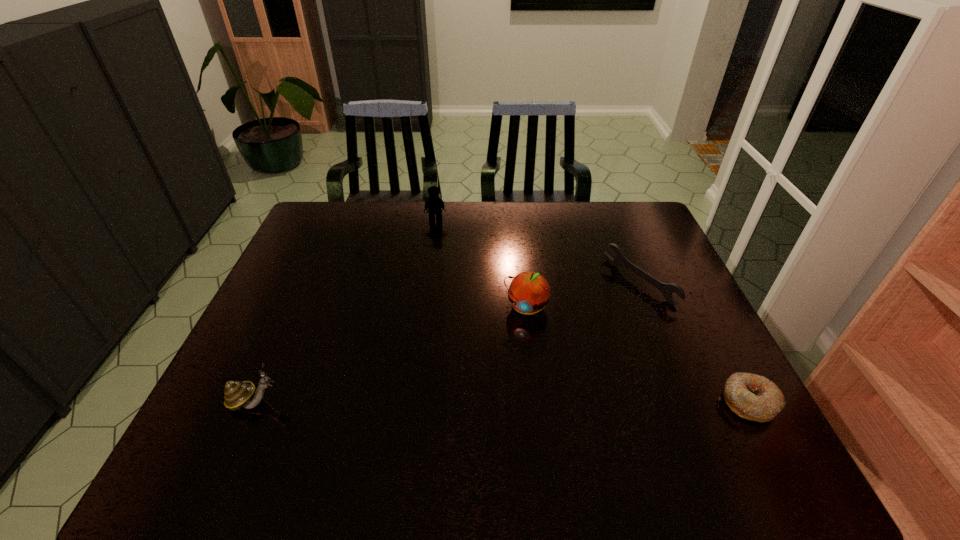
This screenshot has width=960, height=540. What are the coordinates of `object that is at the left edge` in the screenshot? It's located at (237, 394).

Find the location of a particular element. doughnut at the right edge is located at coordinates (753, 397).

Image resolution: width=960 pixels, height=540 pixels. I want to click on wrench that is at the right edge, so click(x=666, y=289).

The image size is (960, 540). I want to click on object that is at the near left corner, so click(237, 394).

I want to click on object that is at the near right corner, so click(x=753, y=397).

In the image, there is a desktop. At what (x,y) coordinates should I click in order to perform the action: click on vacant space at the far edge. Please return your answer as a coordinate pair (x, y). Looking at the image, I should click on (521, 221).

Locate an element on the screen. The image size is (960, 540). vacant region at the left edge of the desktop is located at coordinates (255, 356).

In the image, there is a desktop. Where is `vacant region at the right edge`? The image size is (960, 540). vacant region at the right edge is located at coordinates (686, 287).

Identify the location of vacant space at the far left corner of the desktop. Image resolution: width=960 pixels, height=540 pixels. (357, 214).

You are a GUI agent. You are given a task and a screenshot of the screen. Output one action in this format:
    pyautogui.click(x=<x>, y=<y>)
    Task: Click on the vacant region at the far right corner of the desktop
    
    Given the screenshot: What is the action you would take?
    click(x=634, y=239)